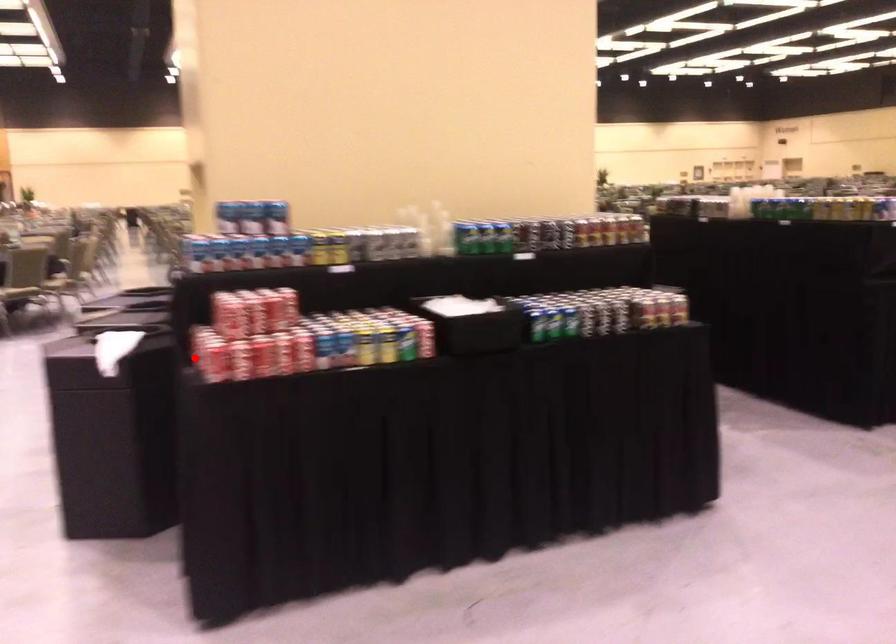
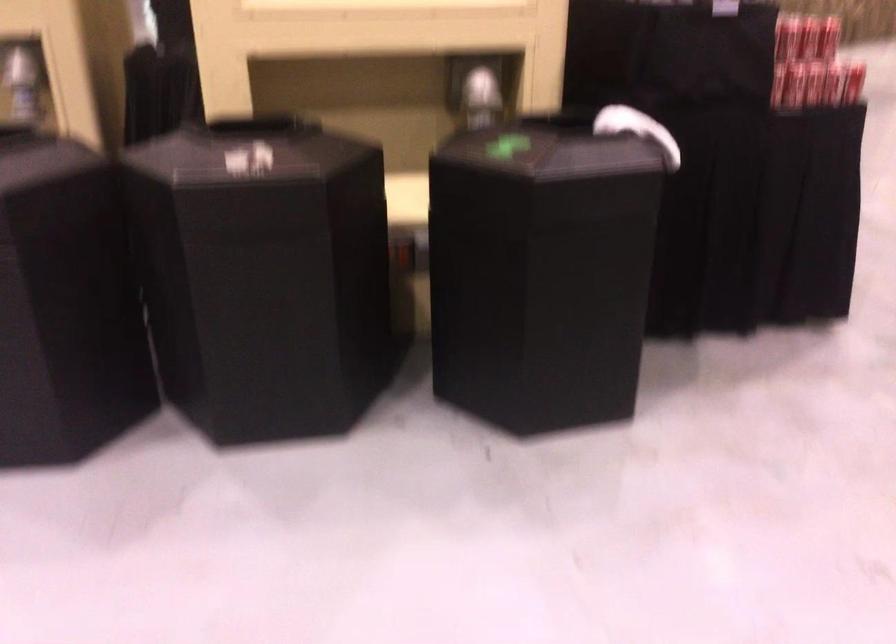
Find the pixel in the second image that matches the highlighted location in the first image.

(833, 84)